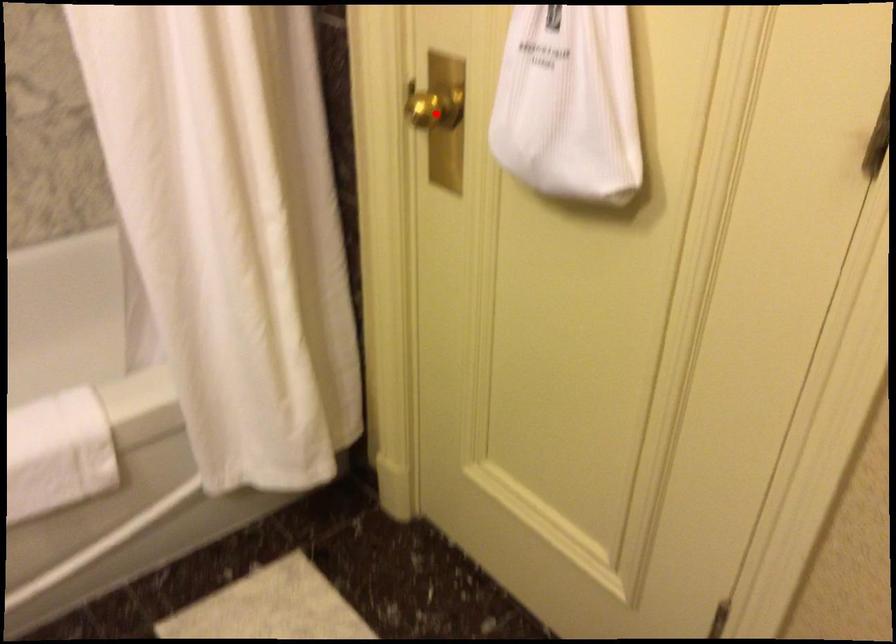
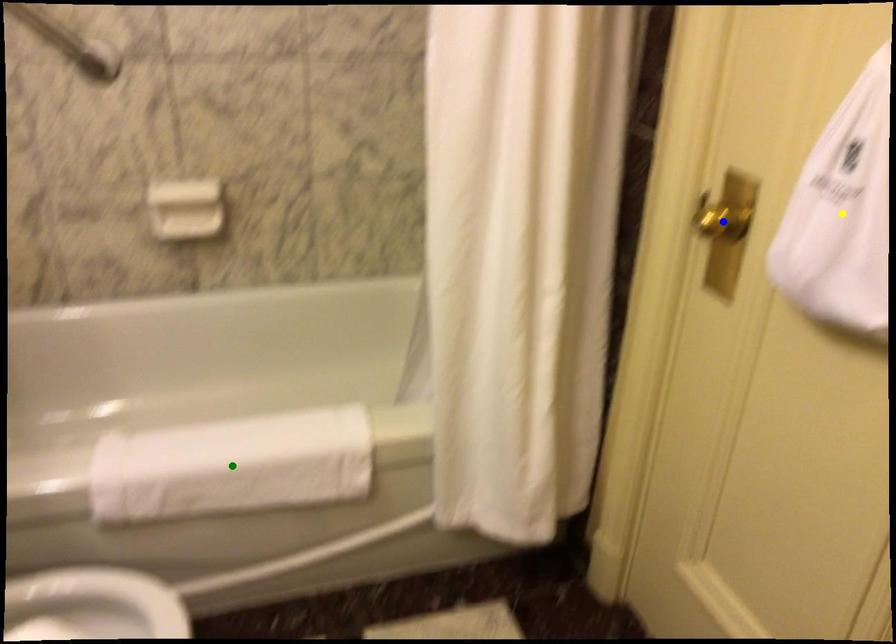
Question: I am providing you with two images of the same scene from different viewpoints. A red point is marked on the first image. You are given multiple points on the second image. Which point in image 2 is actually the same real-world point as the red point in image 1?

Choices:
 (A) blue point
 (B) green point
 (C) yellow point

Answer: (A)